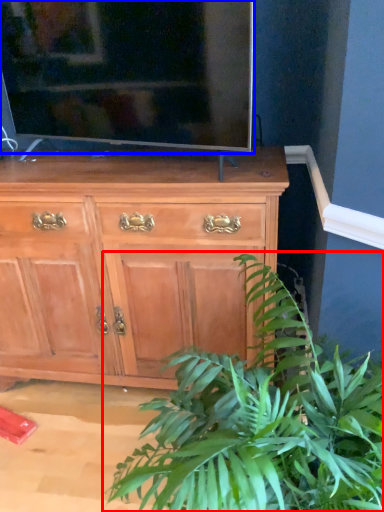
Question: Which point is further to the camera, houseplant (highlighted by a red box) or television (highlighted by a blue box)?

Choices:
 (A) houseplant
 (B) television

Answer: (B)